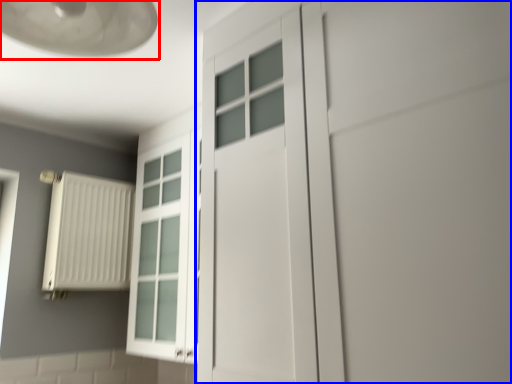
Question: Which object appears closest to the camera in this image, lamp (highlighted by a red box) or door (highlighted by a blue box)?

Choices:
 (A) lamp
 (B) door

Answer: (A)